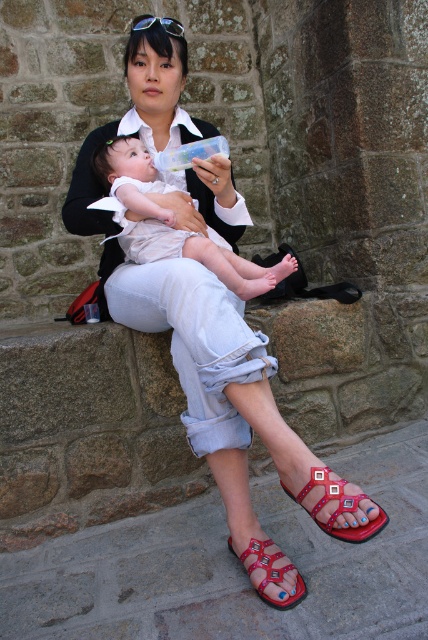
Question: Is matte black shirt at center further to camera compared to red leather sandal at lower center?

Choices:
 (A) no
 (B) yes

Answer: (B)

Question: Which point is closer to the camera?

Choices:
 (A) (288, 563)
 (B) (154, 221)
 (C) (180, 29)
 (D) (240, 340)

Answer: (D)

Question: Does matte black shirt at center have a greater width compared to red leather sandal at lower right?

Choices:
 (A) no
 (B) yes

Answer: (B)

Question: Which is nearer to the matte black shirt at center?

Choices:
 (A) shiny black sunglasses at upper center
 (B) red leather sandal at lower center
 (C) white cotton baby at center
 (D) red leather sandal at lower right

Answer: (C)

Question: Can you confirm if white cotton baby at center is positioned to the left of red leather sandal at lower center?

Choices:
 (A) yes
 (B) no

Answer: (A)

Question: Considering the real-world distances, which object is farthest from the white cotton baby at center?

Choices:
 (A) matte black shirt at center
 (B) red leather sandal at lower center

Answer: (B)